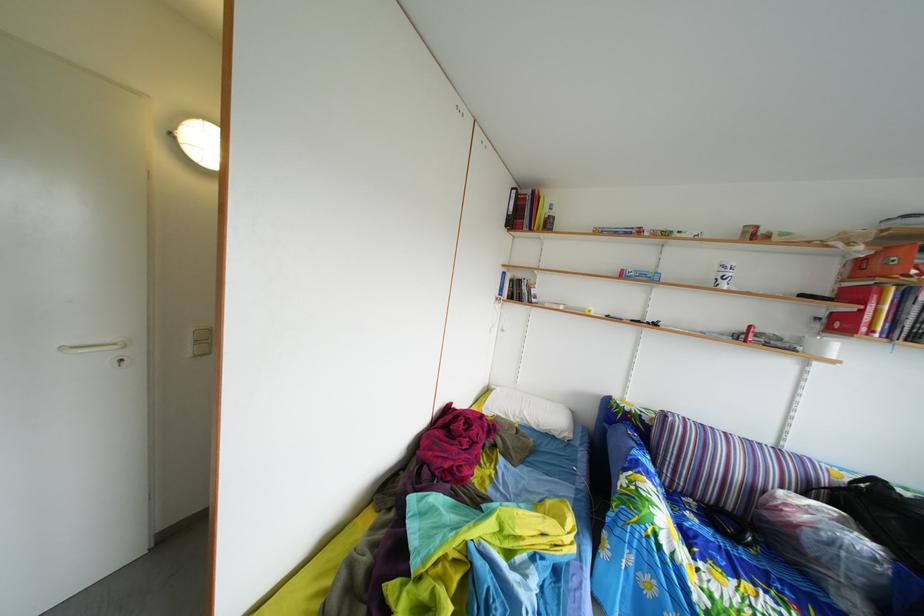
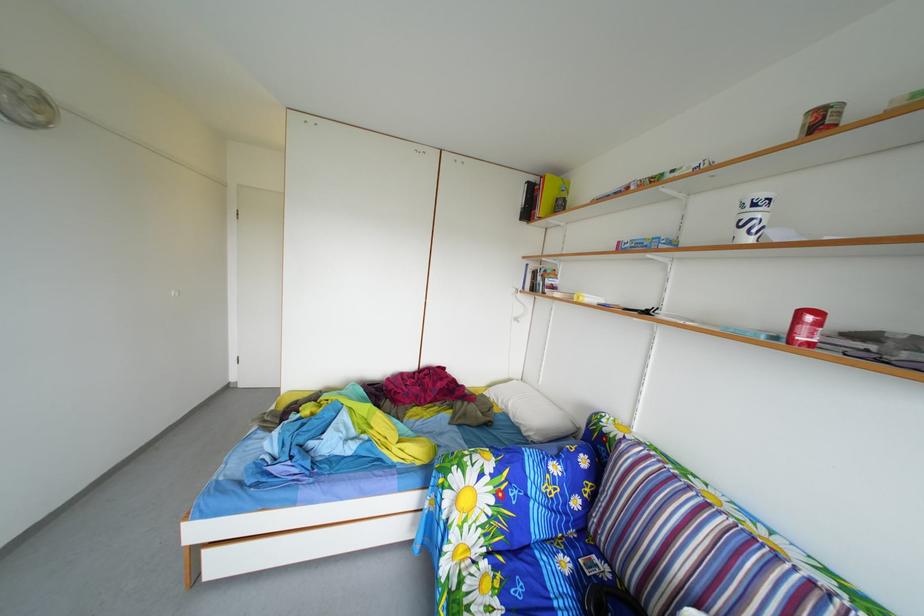
Where in the second image is the point corresponding to point (760, 334) from the first image?

(811, 321)